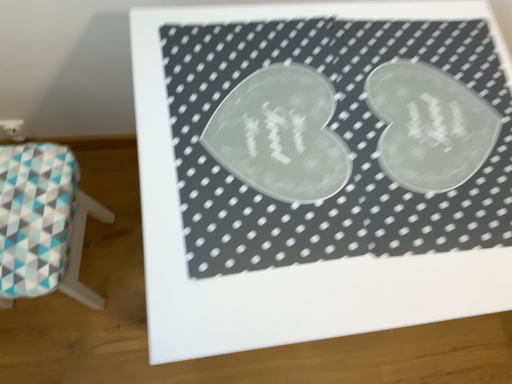
Measure the distance between transparent plastic bulletin board at center and camera.

transparent plastic bulletin board at center is 22.31 inches from camera.

Find the location of a particular element. The image size is (512, 384). transparent plastic bulletin board at center is located at coordinates (316, 203).

The image size is (512, 384). What do you see at coordinates (316, 203) in the screenshot? I see `transparent plastic bulletin board at center` at bounding box center [316, 203].

In order to face transparent plastic bulletin board at center, should I rotate leftwards or rightwards?

Turn right approximately 6.727 degrees to face it.

Locate an element on the screen. The width and height of the screenshot is (512, 384). teal and white fabric stool at lower left is located at coordinates (42, 223).

Describe the element at coordinates (42, 223) in the screenshot. Image resolution: width=512 pixels, height=384 pixels. I see `teal and white fabric stool at lower left` at that location.

In order to click on transparent plastic bulletin board at center in this screenshot , I will do coord(316,203).

In the scene shown: Considering the relative positions of teal and white fabric stool at lower left and transparent plastic bulletin board at center in the image provided, is teal and white fabric stool at lower left to the left of transparent plastic bulletin board at center from the viewer's perspective?

Yes, teal and white fabric stool at lower left is to the left of transparent plastic bulletin board at center.

Does teal and white fabric stool at lower left lie in front of transparent plastic bulletin board at center?

No, it is behind transparent plastic bulletin board at center.

Which is closer, (5, 202) or (325, 73)?

Point (5, 202).

From the image's perspective, which one is positioned higher, teal and white fabric stool at lower left or transparent plastic bulletin board at center?

transparent plastic bulletin board at center, from the image's perspective.

From a real-world perspective, which object rests below the other?

In real-world perspective, teal and white fabric stool at lower left is lower.

Consider the image. Considering the relative sizes of teal and white fabric stool at lower left and transparent plastic bulletin board at center in the image provided, is teal and white fabric stool at lower left wider than transparent plastic bulletin board at center?

No, teal and white fabric stool at lower left is not wider than transparent plastic bulletin board at center.

Is teal and white fabric stool at lower left shorter than transparent plastic bulletin board at center?

Yes.

Between teal and white fabric stool at lower left and transparent plastic bulletin board at center, which one has smaller size?

Smaller between the two is teal and white fabric stool at lower left.

Would you say teal and white fabric stool at lower left is outside transparent plastic bulletin board at center?

Indeed, teal and white fabric stool at lower left is completely outside transparent plastic bulletin board at center.

Are teal and white fabric stool at lower left and transparent plastic bulletin board at center making contact?

No, teal and white fabric stool at lower left is not making contact with transparent plastic bulletin board at center.

Is teal and white fabric stool at lower left oriented towards transparent plastic bulletin board at center?

Yes, teal and white fabric stool at lower left is facing transparent plastic bulletin board at center.

Based on the photo, can you tell me how much teal and white fabric stool at lower left and transparent plastic bulletin board at center differ in facing direction?

The angular difference between teal and white fabric stool at lower left and transparent plastic bulletin board at center is 83.3 degrees.

Locate an element on the screen. bulletin board lying in front of the teal and white fabric stool at lower left is located at coordinates (316, 203).

Does transparent plastic bulletin board at center appear on the left side of teal and white fabric stool at lower left?

In fact, transparent plastic bulletin board at center is to the right of teal and white fabric stool at lower left.

Is transparent plastic bulletin board at center further to the viewer compared to teal and white fabric stool at lower left?

No, it is not.

Which is in front, point (179, 348) or point (83, 301)?

The point (179, 348) is closer.

From the image's perspective, would you say transparent plastic bulletin board at center is shown under teal and white fabric stool at lower left?

Actually, transparent plastic bulletin board at center appears above teal and white fabric stool at lower left in the image.

From a real-world perspective, is transparent plastic bulletin board at center positioned over teal and white fabric stool at lower left based on gravity?

Correct, in the physical world, transparent plastic bulletin board at center is higher than teal and white fabric stool at lower left.

Considering the sizes of objects transparent plastic bulletin board at center and teal and white fabric stool at lower left in the image provided, who is wider, transparent plastic bulletin board at center or teal and white fabric stool at lower left?

With larger width is transparent plastic bulletin board at center.

In terms of height, does transparent plastic bulletin board at center look taller or shorter compared to teal and white fabric stool at lower left?

transparent plastic bulletin board at center is taller than teal and white fabric stool at lower left.

Considering the sizes of objects transparent plastic bulletin board at center and teal and white fabric stool at lower left in the image provided, who is bigger, transparent plastic bulletin board at center or teal and white fabric stool at lower left?

With larger size is transparent plastic bulletin board at center.

Is teal and white fabric stool at lower left a part of transparent plastic bulletin board at center?

No, teal and white fabric stool at lower left is not a part of transparent plastic bulletin board at center.

Is transparent plastic bulletin board at center not close to teal and white fabric stool at lower left?

No, transparent plastic bulletin board at center is not far from teal and white fabric stool at lower left.

Is transparent plastic bulletin board at center facing towards teal and white fabric stool at lower left?

No, transparent plastic bulletin board at center is not turned towards teal and white fabric stool at lower left.

How many degrees apart are the facing directions of transparent plastic bulletin board at center and teal and white fabric stool at lower left?

The angle between the facing direction of transparent plastic bulletin board at center and the facing direction of teal and white fabric stool at lower left is 83.3 degrees.

Locate an element on the screen. Image resolution: width=512 pixels, height=384 pixels. bulletin board above the teal and white fabric stool at lower left (from a real-world perspective) is located at coordinates (316, 203).

Locate an element on the screen. This screenshot has width=512, height=384. bulletin board in front of the teal and white fabric stool at lower left is located at coordinates (316, 203).

Identify the location of bulletin board located above the teal and white fabric stool at lower left (from a real-world perspective). The width and height of the screenshot is (512, 384). (316, 203).